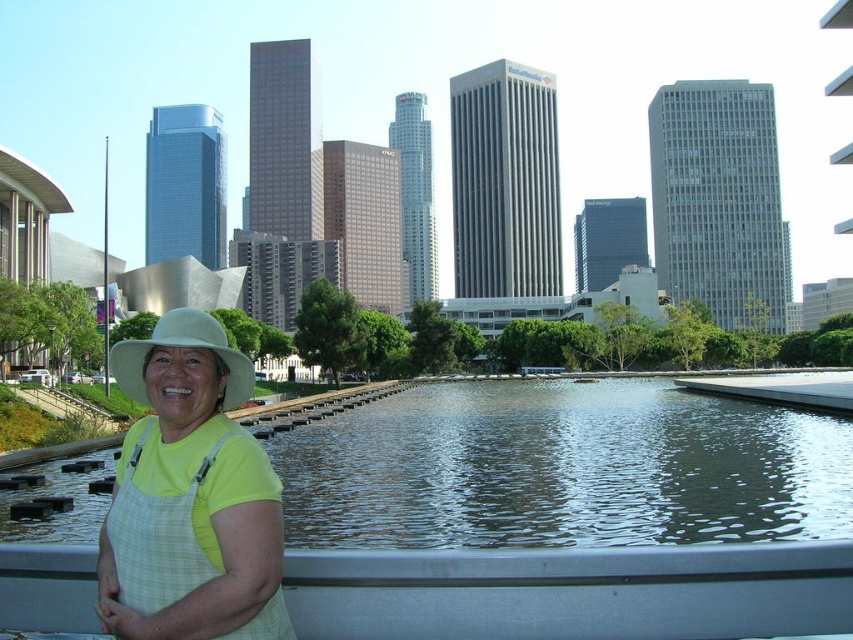
Does clear water at center appear on the left side of white matte hat at lower left?

No, clear water at center is not to the left of white matte hat at lower left.

Is point (370, 536) less distant than point (148, 346)?

No, it is behind (148, 346).

The height and width of the screenshot is (640, 853). What are the coordinates of `clear water at center` in the screenshot? It's located at (563, 468).

Which of these two, clear water at center or yellow-green fabric apron at lower left, stands shorter?

With less height is clear water at center.

Is point (403, 468) positioned in front of point (189, 509)?

That is False.

You are a GUI agent. You are given a task and a screenshot of the screen. Output one action in this format:
    pyautogui.click(x=<x>, y=<y>)
    Task: Click on the clear water at center
    This screenshot has width=853, height=640.
    Given the screenshot: What is the action you would take?
    click(x=563, y=468)

Between yellow-green fabric apron at lower left and white matte hat at lower left, which one is positioned higher?

white matte hat at lower left is above.

Is point (120, 616) closer to viewer compared to point (239, 362)?

Yes, it is.

The height and width of the screenshot is (640, 853). I want to click on yellow-green fabric apron at lower left, so click(x=190, y=497).